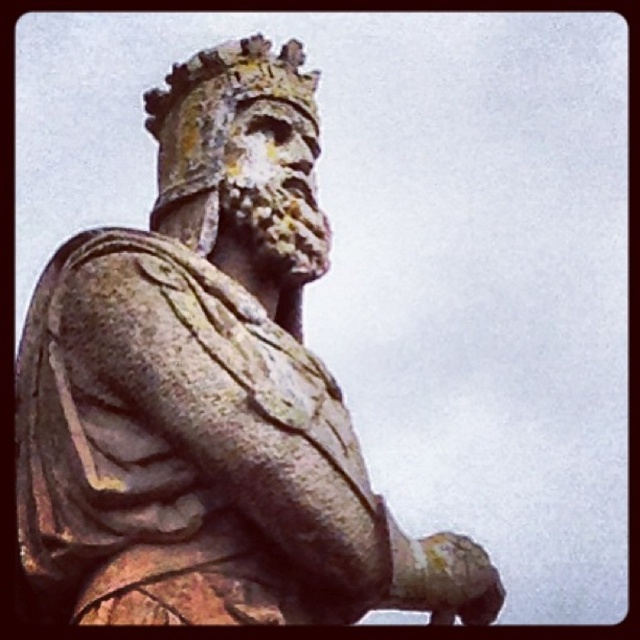
Question: Which point is farther from the camera taking this photo?

Choices:
 (A) (294, 77)
 (B) (289, 378)

Answer: (A)

Question: Which point is farther to the camera?

Choices:
 (A) rusty stone crown at upper center
 (B) rusty stone statue at center

Answer: (A)

Question: Can you confirm if rusty stone statue at center is positioned to the left of rusty stone crown at upper center?

Choices:
 (A) no
 (B) yes

Answer: (A)

Question: Which of the following is the closest to the observer?

Choices:
 (A) rusty stone statue at center
 (B) rusty stone crown at upper center

Answer: (A)

Question: From the image, what is the correct spatial relationship of rusty stone statue at center in relation to rusty stone crown at upper center?

Choices:
 (A) above
 (B) below

Answer: (B)

Question: Can you confirm if rusty stone statue at center is positioned below rusty stone crown at upper center?

Choices:
 (A) no
 (B) yes

Answer: (B)